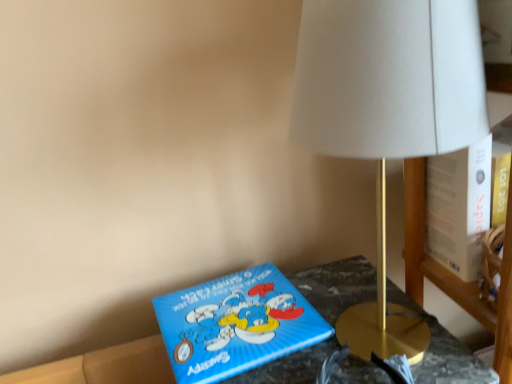
Measure the distance between point [397,21] and camera.

The distance of point [397,21] from camera is 15.91 inches.

The height and width of the screenshot is (384, 512). I want to click on blue matte puzzle box at lower center, so click(236, 324).

This screenshot has height=384, width=512. Find the location of `gold metallic lamp at upper right`. gold metallic lamp at upper right is located at coordinates (388, 115).

Are gold metallic lamp at upper right and blue cardboard box at lower left making contact?

No, gold metallic lamp at upper right is not making contact with blue cardboard box at lower left.

In the image, is gold metallic lamp at upper right positioned in front of or behind blue cardboard box at lower left?

Clearly, gold metallic lamp at upper right is in front of blue cardboard box at lower left.

At what (x,y) coordinates should I click in order to perform the action: click on lamp that is on the right side of blue cardboard box at lower left. Please return your answer as a coordinate pair (x, y). This screenshot has height=384, width=512. Looking at the image, I should click on (388, 115).

Is point (403, 311) farther from viewer compared to point (348, 280)?

No, (403, 311) is in front of (348, 280).

Looking at this image, would you say blue cardboard box at lower left is a long distance from blue matte puzzle box at lower center?

They are positioned close to each other.

Consider the image. Considering the sizes of objects blue cardboard box at lower left and blue matte puzzle box at lower center in the image provided, who is wider, blue cardboard box at lower left or blue matte puzzle box at lower center?

blue cardboard box at lower left is wider.

Is blue cardboard box at lower left facing towards blue matte puzzle box at lower center?

No, blue cardboard box at lower left does not turn towards blue matte puzzle box at lower center.

In the image, there is a gold metallic lamp at upper right. Identify the location of book below it (from the image's perspective). (236, 324).

Is gold metallic lamp at upper right looking in the opposite direction of blue matte puzzle box at lower center?

That's not correct — gold metallic lamp at upper right is not looking away from blue matte puzzle box at lower center.

Who is smaller, gold metallic lamp at upper right or blue matte puzzle box at lower center?

With smaller size is blue matte puzzle box at lower center.

Between gold metallic lamp at upper right and blue matte puzzle box at lower center, which one has smaller width?

With smaller width is blue matte puzzle box at lower center.

Is blue matte puzzle box at lower center oriented towards blue cardboard box at lower left?

Yes, blue matte puzzle box at lower center faces towards blue cardboard box at lower left.

Can you confirm if blue matte puzzle box at lower center is positioned to the right of blue cardboard box at lower left?

In fact, blue matte puzzle box at lower center is to the left of blue cardboard box at lower left.

Between blue matte puzzle box at lower center and blue cardboard box at lower left, which one has more height?

With more height is blue cardboard box at lower left.

In the scene shown: From a real-world perspective, does blue cardboard box at lower left sit lower than gold metallic lamp at upper right?

Indeed, from a real-world perspective, blue cardboard box at lower left is positioned beneath gold metallic lamp at upper right.

Which point is more forward, (111, 369) or (327, 143)?

The point (327, 143) is more forward.

Locate an element on the screen. The height and width of the screenshot is (384, 512). lamp lying on the right of blue cardboard box at lower left is located at coordinates (388, 115).

Is point (172, 354) closer or farther from the camera than point (344, 135)?

Clearly, point (172, 354) is more distant from the camera than point (344, 135).

Is blue matte puzzle box at lower center facing towards gold metallic lamp at upper right?

No.

Considering the positions of objects blue matte puzzle box at lower center and gold metallic lamp at upper right in the image provided, who is in front, blue matte puzzle box at lower center or gold metallic lamp at upper right?

gold metallic lamp at upper right is closer to the camera.

From their relative heights in the image, would you say blue matte puzzle box at lower center is taller or shorter than gold metallic lamp at upper right?

Clearly, blue matte puzzle box at lower center is shorter compared to gold metallic lamp at upper right.

Locate an element on the screen. The height and width of the screenshot is (384, 512). lamp that is on the right side of blue cardboard box at lower left is located at coordinates (388, 115).

The width and height of the screenshot is (512, 384). In order to click on furniture in front of the blue matte puzzle box at lower center in this screenshot , I will do `click(336, 285)`.

Looking at the image, which one is located closer to blue cardboard box at lower left, blue matte puzzle box at lower center or gold metallic lamp at upper right?

blue matte puzzle box at lower center lies closer to blue cardboard box at lower left than the other object.

Based on their spatial positions, is blue cardboard box at lower left or blue matte puzzle box at lower center closer to gold metallic lamp at upper right?

blue cardboard box at lower left is positioned closer to the anchor gold metallic lamp at upper right.

Based on their spatial positions, is blue cardboard box at lower left or gold metallic lamp at upper right closer to blue matte puzzle box at lower center?

The object closer to blue matte puzzle box at lower center is blue cardboard box at lower left.

Looking at this image, which object lies further to the anchor point blue matte puzzle box at lower center, gold metallic lamp at upper right or blue cardboard box at lower left?

gold metallic lamp at upper right.

Considering their positions, is gold metallic lamp at upper right positioned further to blue cardboard box at lower left than blue matte puzzle box at lower center?

gold metallic lamp at upper right is further to blue cardboard box at lower left.

Looking at the image, which one is located closer to gold metallic lamp at upper right, blue matte puzzle box at lower center or blue cardboard box at lower left?

blue cardboard box at lower left lies closer to gold metallic lamp at upper right than the other object.

Locate an element on the screen. book between gold metallic lamp at upper right and blue cardboard box at lower left from top to bottom is located at coordinates (236, 324).